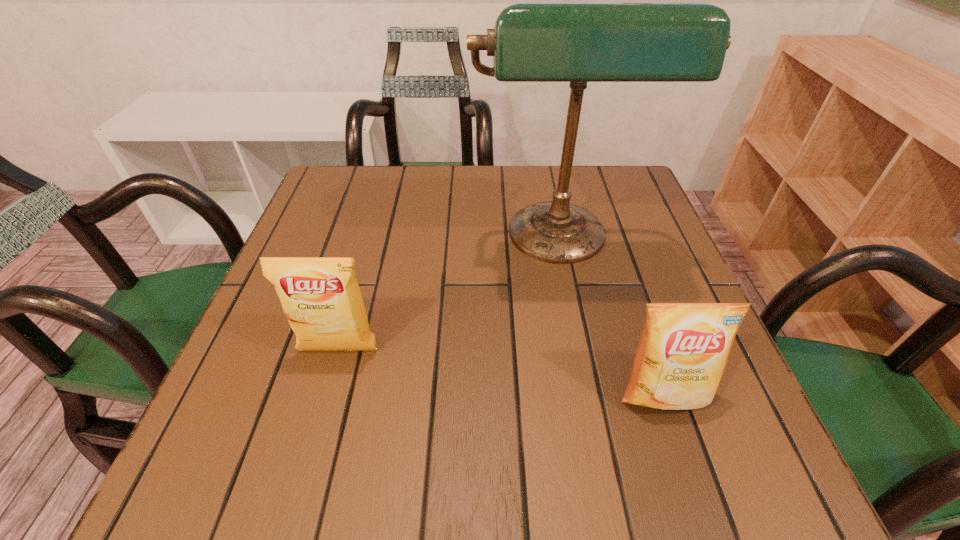
Image resolution: width=960 pixels, height=540 pixels. I want to click on object that is at the left edge, so (321, 298).

You are a GUI agent. You are given a task and a screenshot of the screen. Output one action in this format:
    pyautogui.click(x=<x>, y=<y>)
    Task: Click on the table lamp located at the right edge
    This screenshot has height=540, width=960.
    Given the screenshot: What is the action you would take?
    pyautogui.click(x=578, y=43)

Find the location of a particular element. The height and width of the screenshot is (540, 960). crisp (potato chip) that is at the right edge is located at coordinates (683, 352).

The height and width of the screenshot is (540, 960). In order to click on object located at the far right corner in this screenshot , I will do `click(578, 43)`.

Locate an element on the screen. The width and height of the screenshot is (960, 540). vacant area at the far edge is located at coordinates (502, 198).

In the image, there is a desktop. At what (x,y) coordinates should I click in order to perform the action: click on vacant space at the near edge. Please return your answer as a coordinate pair (x, y). The height and width of the screenshot is (540, 960). Looking at the image, I should click on (338, 477).

This screenshot has height=540, width=960. I want to click on free point at the left edge, so click(x=275, y=316).

Find the location of a particular element. This screenshot has width=960, height=540. free location at the right edge of the desktop is located at coordinates (672, 278).

This screenshot has height=540, width=960. What are the coordinates of `vacant space at the far left corner of the desktop` in the screenshot? It's located at (332, 173).

Where is `free region at the far right corner of the desktop`? free region at the far right corner of the desktop is located at coordinates (613, 202).